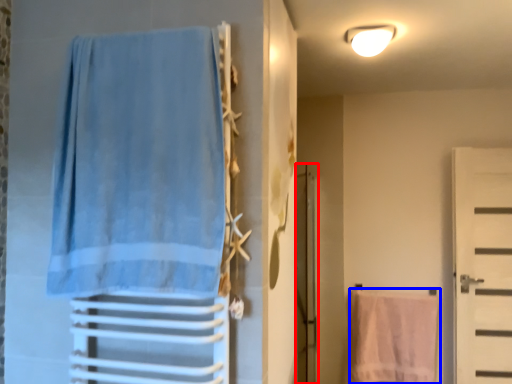
Question: Among these objects, which one is nearest to the camera, screen door (highlighted by a red box) or beach towel (highlighted by a blue box)?

Choices:
 (A) screen door
 (B) beach towel

Answer: (A)